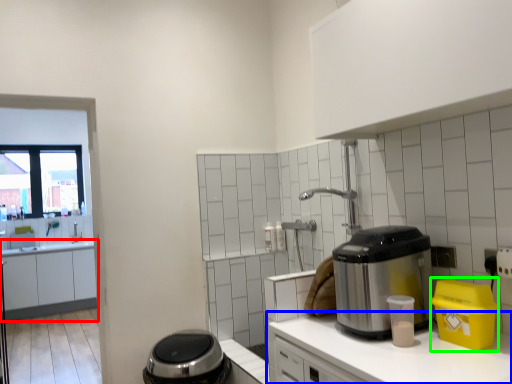
Question: Based on their relative distances, which object is nearer to cabinetry (highlighted by a red box)? Choose from countertop (highlighted by a blue box) and appliance (highlighted by a green box).

Choices:
 (A) countertop
 (B) appliance

Answer: (A)